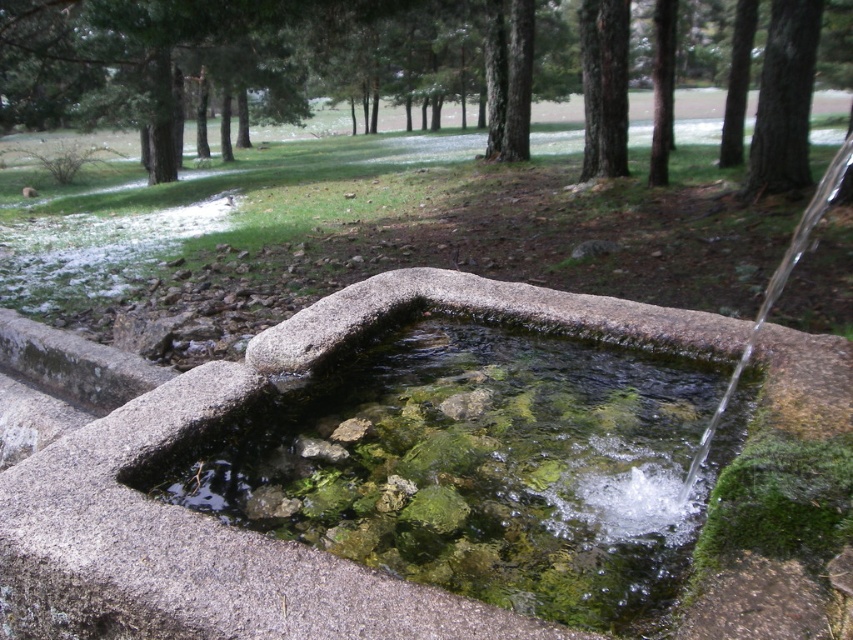
Question: Estimate the real-world distances between objects in this image. Which object is closer to the green mossy stone at center?

Choices:
 (A) green mossy tree at upper center
 (B) green leafy tree at upper center
 (C) dark brown bark tree at upper right

Answer: (C)

Question: Can you confirm if green mossy stone at center is wider than green mossy tree at upper center?

Choices:
 (A) yes
 (B) no

Answer: (B)

Question: Which object appears farthest from the camera in this image?

Choices:
 (A) dark brown bark tree at upper right
 (B) green mossy tree at upper center
 (C) green mossy stone at center
 (D) green leafy tree at upper center

Answer: (B)

Question: Is the position of dark brown bark tree at upper right more distant than that of green mossy tree at upper center?

Choices:
 (A) yes
 (B) no

Answer: (B)

Question: Is green leafy tree at upper center below dark brown bark tree at upper right?

Choices:
 (A) yes
 (B) no

Answer: (B)

Question: Which of the following is the closest to the observer?

Choices:
 (A) green mossy tree at upper center
 (B) dark brown bark tree at upper right
 (C) green mossy stone at center

Answer: (C)